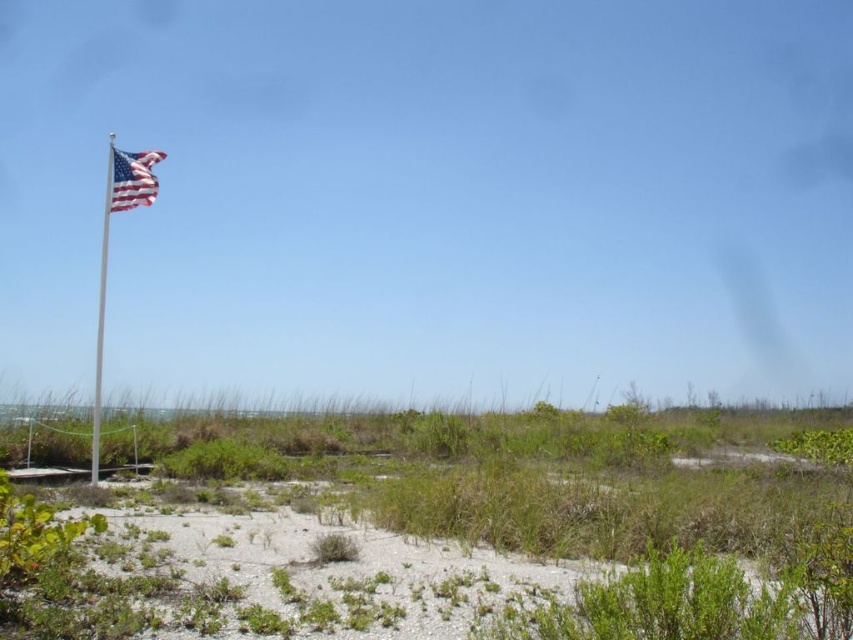
Who is higher up, green grassy sand at center or matte fabric flag at left?

matte fabric flag at left is higher up.

Can you confirm if green grassy sand at center is smaller than matte fabric flag at left?

No.

Is point (409, 451) more distant than point (140, 156)?

Yes, point (409, 451) is behind point (140, 156).

I want to click on green grassy sand at center, so [566, 476].

Which is behind, point (416, 464) or point (97, 344)?

The point (416, 464) is more distant.

Can you confirm if green grassy sand at center is positioned below white metallic flag pole at left?

Yes, green grassy sand at center is below white metallic flag pole at left.

Locate an element on the screen. The image size is (853, 640). green grassy sand at center is located at coordinates (x=566, y=476).

Where is `green grassy sand at center`? The width and height of the screenshot is (853, 640). green grassy sand at center is located at coordinates (566, 476).

Is matte fabric flag at left shorter than white metallic flag pole at left?

Yes, matte fabric flag at left is shorter than white metallic flag pole at left.

From the picture: Does matte fabric flag at left appear on the left side of white metallic flag pole at left?

A: No, matte fabric flag at left is not to the left of white metallic flag pole at left.

Measure the distance between matte fabric flag at left and camera.

matte fabric flag at left and camera are 15.54 meters apart.

What are the coordinates of `matte fabric flag at left` in the screenshot? It's located at (132, 179).